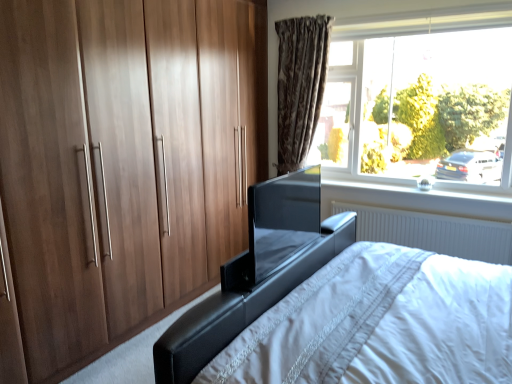
Measure the distance between point (263, 186) and camera.

A distance of 6.14 feet exists between point (263, 186) and camera.

Image resolution: width=512 pixels, height=384 pixels. In order to click on white plastic radiator at lower right in this screenshot , I will do `click(433, 232)`.

The height and width of the screenshot is (384, 512). Describe the element at coordinates (433, 232) in the screenshot. I see `white plastic radiator at lower right` at that location.

Measure the distance between black leather bed frame at lower center and camera.

1.36 meters.

Identify the location of transparent glass tv at center. (282, 219).

How many degrees apart are the facing directions of brown textured curtain at upper center and white glossy window sill at upper right?

There is a 0.394-degree angle between the facing directions of brown textured curtain at upper center and white glossy window sill at upper right.

Can you confirm if brown textured curtain at upper center is wider than white glossy window sill at upper right?

In fact, brown textured curtain at upper center might be narrower than white glossy window sill at upper right.

Between brown textured curtain at upper center and white glossy window sill at upper right, which one appears on the left side from the viewer's perspective?

brown textured curtain at upper center is more to the left.

Does brown textured curtain at upper center turn towards white glossy window sill at upper right?

No, brown textured curtain at upper center is not facing towards white glossy window sill at upper right.

Would you say white glossy window sill at upper right is part of black leather bed frame at lower center's contents?

Definitely not — white glossy window sill at upper right is not inside black leather bed frame at lower center.

Is point (220, 330) farther from viewer compared to point (392, 193)?

No.

The image size is (512, 384). What are the coordinates of `bed frame on the left side of white glossy window sill at upper right` in the screenshot? It's located at tap(240, 308).

From the picture: Is black leather bed frame at lower center positioned before white glossy window sill at upper right?

Yes, it is in front of white glossy window sill at upper right.

Based on the photo, is white plastic radiator at lower right positioned before black leather bed at center?

No, white plastic radiator at lower right is further to the viewer.

Is white plastic radiator at lower right facing away from black leather bed at center?

white plastic radiator at lower right does not have its back to black leather bed at center.

In terms of size, does white plastic radiator at lower right appear bigger or smaller than black leather bed at center?

Considering their sizes, white plastic radiator at lower right takes up less space than black leather bed at center.

In terms of height, does white plastic radiator at lower right look taller or shorter compared to black leather bed at center?

Clearly, white plastic radiator at lower right is shorter compared to black leather bed at center.

Is black leather bed at center placed right next to transparent glass window at upper right?

No, black leather bed at center is not with transparent glass window at upper right.

From the image's perspective, which one is positioned lower, black leather bed at center or transparent glass window at upper right?

black leather bed at center, from the image's perspective.

Measure the distance between black leather bed at center and transparent glass window at upper right.

A distance of 1.63 meters exists between black leather bed at center and transparent glass window at upper right.

Is white plastic radiator at lower right oriented away from white glossy window sill at upper right?

No, white plastic radiator at lower right's orientation is not away from white glossy window sill at upper right.

Is white plastic radiator at lower right positioned behind white glossy window sill at upper right?

No, the depth of white plastic radiator at lower right is less than that of white glossy window sill at upper right.

Based on the photo, from the image's perspective, between white plastic radiator at lower right and white glossy window sill at upper right, who is located below?

white plastic radiator at lower right, from the image's perspective.

Is white plastic radiator at lower right spatially inside white glossy window sill at upper right, or outside of it?

white plastic radiator at lower right cannot be found inside white glossy window sill at upper right.

Are black leather bed at center and transparent glass tv at center beside each other?

Yes, black leather bed at center is touching transparent glass tv at center.

From the image's perspective, is black leather bed at center located beneath transparent glass tv at center?

Yes.

Consider the image. From a real-world perspective, does black leather bed at center sit lower than transparent glass tv at center?

Yes, from a real-world perspective, black leather bed at center is under transparent glass tv at center.

Is black leather bed at center facing towards transparent glass tv at center?

Yes, black leather bed at center is oriented towards transparent glass tv at center.

Is transparent glass window at upper right situated inside white plastic radiator at lower right or outside?

transparent glass window at upper right is not enclosed by white plastic radiator at lower right.

Locate an element on the screen. The height and width of the screenshot is (384, 512). radiator below the transparent glass window at upper right (from a real-world perspective) is located at coordinates (433, 232).

From a real-world perspective, is transparent glass window at upper right located higher than white plastic radiator at lower right?

Yes.

Measure the distance from transparent glass window at upper right to white plastic radiator at lower right.

transparent glass window at upper right and white plastic radiator at lower right are 33.23 inches apart from each other.

This screenshot has height=384, width=512. I want to click on window sill below the brown textured curtain at upper center (from the image's perspective), so click(x=418, y=199).

What are the coordinates of `window sill located above the black leather bed frame at lower center (from a real-world perspective)` in the screenshot? It's located at (418, 199).

From the image, which object appears to be nearer to transparent glass window at upper right, brown textured curtain at upper center or wooden wardrobe at left?

Among the two, brown textured curtain at upper center is located nearer to transparent glass window at upper right.

Based on their spatial positions, is transparent glass tv at center or white glossy window sill at upper right closer to transparent glass window at upper right?

white glossy window sill at upper right is closer to transparent glass window at upper right.

Based on the photo, based on their spatial positions, is black leather bed at center or white plastic radiator at lower right further from transparent glass window at upper right?

black leather bed at center.

Looking at the image, which one is located further to black leather bed at center, transparent glass tv at center or white glossy window sill at upper right?

white glossy window sill at upper right lies further to black leather bed at center than the other object.

From the image, which object appears to be nearer to transparent glass tv at center, transparent glass window at upper right or wooden wardrobe at left?

wooden wardrobe at left lies closer to transparent glass tv at center than the other object.

From the image, which object appears to be farther from wooden wardrobe at left, black leather bed at center or black leather bed frame at lower center?

Among the two, black leather bed frame at lower center is located further to wooden wardrobe at left.

From the image, which object appears to be farther from transparent glass window at upper right, brown textured curtain at upper center or black leather bed at center?

→ black leather bed at center is positioned further to the anchor transparent glass window at upper right.

Based on their spatial positions, is black leather bed at center or wooden wardrobe at left closer to white glossy window sill at upper right?

black leather bed at center is positioned closer to the anchor white glossy window sill at upper right.

Where is `window sill between wooden wardrobe at left and brown textured curtain at upper center in the front-back direction`? window sill between wooden wardrobe at left and brown textured curtain at upper center in the front-back direction is located at coordinates (418, 199).

What are the coordinates of `window screen located between black leather bed frame at lower center and white glossy window sill at upper right in the depth direction` in the screenshot? It's located at (282, 219).

Locate an element on the screen. This screenshot has height=384, width=512. window sill between black leather bed at center and brown textured curtain at upper center along the z-axis is located at coordinates (418, 199).

Locate an element on the screen. bed frame between black leather bed at center and white glossy window sill at upper right from front to back is located at coordinates (240, 308).